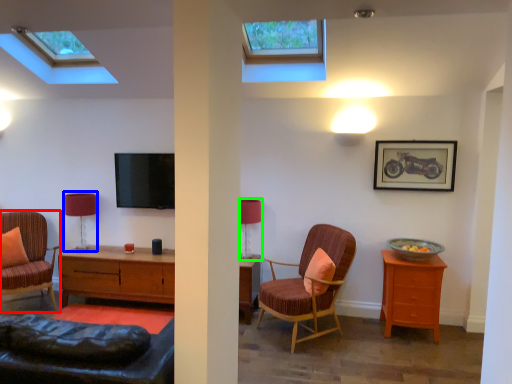
Question: Which is farther away from chair (highlighted by a red box)? table lamp (highlighted by a blue box) or table lamp (highlighted by a green box)?

Choices:
 (A) table lamp
 (B) table lamp

Answer: (B)